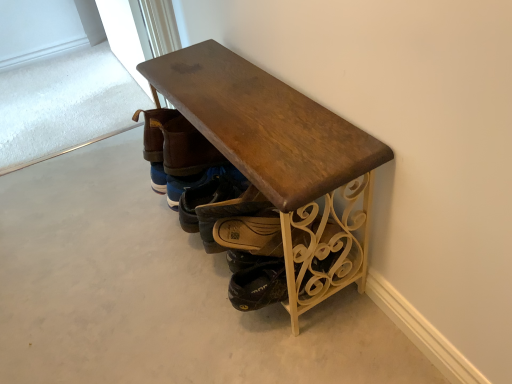
Question: Visually, is brown leather boot at center, arranged as the first footwear when viewed from the back, positioned to the left or to the right of brown leather shoe at center, acting as the 2th footwear starting from the back?

Choices:
 (A) right
 (B) left

Answer: (B)

Question: Relative to brown leather shoe at center, acting as the 3th footwear starting from the front, is brown leather boot at center, arranged as the first footwear when viewed from the back, in front or behind?

Choices:
 (A) behind
 (B) front

Answer: (A)

Question: Which object is positioned closest to the brown leather shoe at center, positioned as the 2th footwear in front-to-back order?

Choices:
 (A) brown leather shoe at center, acting as the 2th footwear starting from the back
 (B) brown leather shoes at center, acting as the first footwear starting from the front
 (C) brown leather boot at center, arranged as the first footwear when viewed from the back

Answer: (A)

Question: Estimate the real-world distances between objects in this image. Which object is closer to the brown leather shoes at center, acting as the first footwear starting from the front?

Choices:
 (A) brown leather shoe at center, the third footwear viewed from the back
 (B) brown leather shoe at center, acting as the 3th footwear starting from the front
 (C) brown leather boot at center, arranged as the first footwear when viewed from the back

Answer: (B)